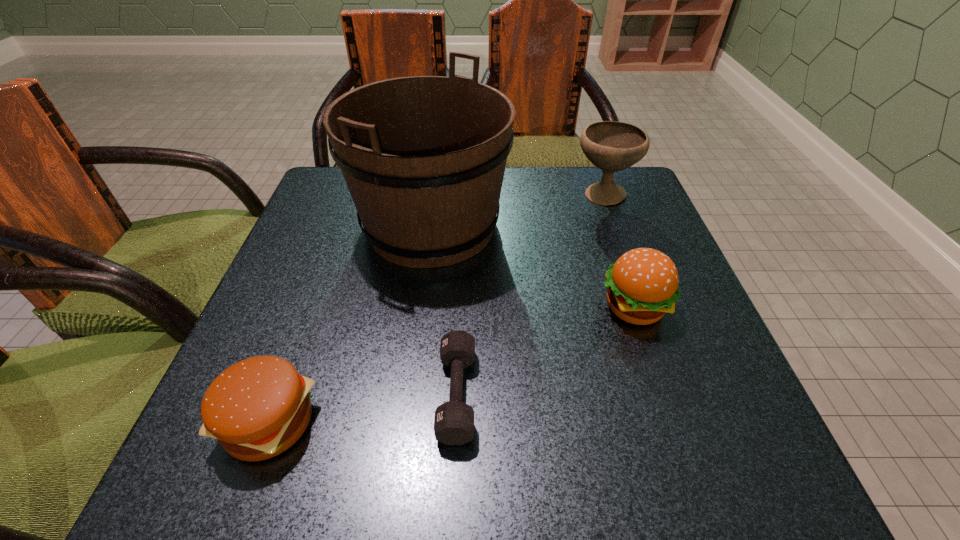
You are a GUI agent. You are given a task and a screenshot of the screen. Output one action in this format:
    pyautogui.click(x=<x>, y=<y>)
    Task: Click on the free region located on the back of the shorter hamburger
    The width and height of the screenshot is (960, 540).
    Given the screenshot: What is the action you would take?
    pyautogui.click(x=325, y=270)

Identify the location of blank space located 0.240m on the back of the dumbbell. (463, 256).

The width and height of the screenshot is (960, 540). I want to click on bucket positioned at the far edge, so click(x=424, y=157).

Where is `chalice at the far edge`? chalice at the far edge is located at coordinates (612, 146).

Locate an element on the screen. This screenshot has width=960, height=540. hamburger at the near edge is located at coordinates (257, 408).

Locate an element on the screen. The image size is (960, 540). dumbbell at the near edge is located at coordinates (454, 420).

Identify the location of bucket situated at the left edge. Image resolution: width=960 pixels, height=540 pixels. (424, 157).

This screenshot has height=540, width=960. I want to click on hamburger located in the left edge section of the desktop, so click(257, 408).

Locate an element on the screen. The height and width of the screenshot is (540, 960). chalice that is at the right edge is located at coordinates (612, 146).

At what (x,y) coordinates should I click in order to perform the action: click on hamburger that is positioned at the right edge. Please return your answer as a coordinate pair (x, y). Image resolution: width=960 pixels, height=540 pixels. Looking at the image, I should click on (642, 285).